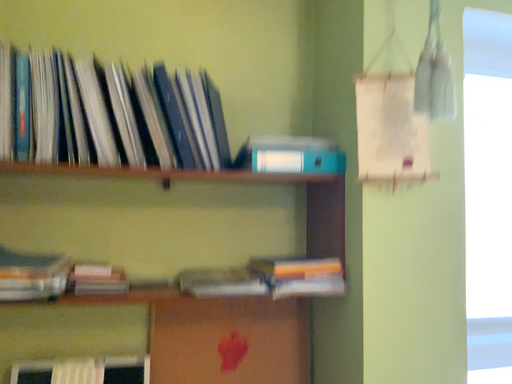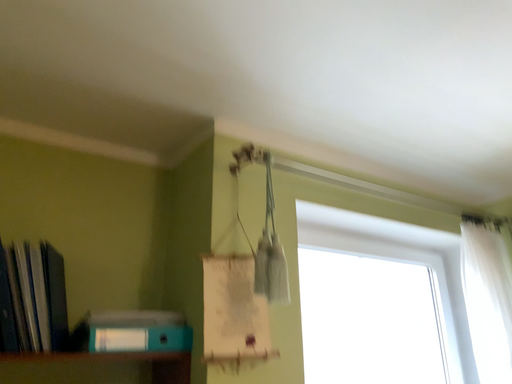
Question: How did the camera likely rotate when shooting the video?

Choices:
 (A) rotated right
 (B) rotated left

Answer: (A)